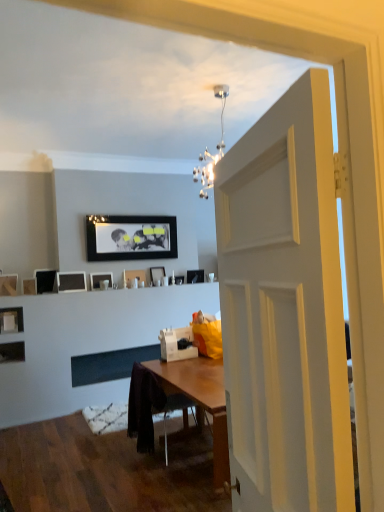
Identify the location of vacant area that is in front of wooden chair at center. (168, 475).